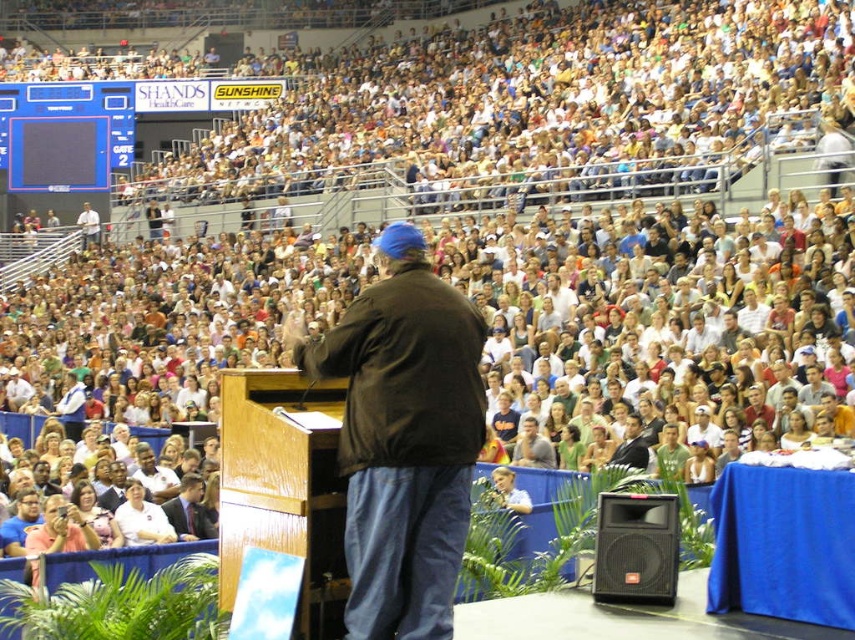
Which is below, dark brown leather jacket at center or black plastic speaker at lower right?

Positioned lower is black plastic speaker at lower right.

Who is positioned more to the left, dark brown leather jacket at center or black plastic speaker at lower right?

dark brown leather jacket at center is more to the left.

What do you see at coordinates (404, 438) in the screenshot? The width and height of the screenshot is (855, 640). I see `dark brown leather jacket at center` at bounding box center [404, 438].

I want to click on dark brown leather jacket at center, so click(x=404, y=438).

Is black plastic speaker at lower right taller than white shirt at lower left?

Correct, black plastic speaker at lower right is much taller as white shirt at lower left.

Measure the distance between black plastic speaker at lower right and camera.

They are 19.55 meters apart.

Identify the location of black plastic speaker at lower right. The image size is (855, 640). (635, 548).

Does dark brown leather jacket at center have a greater height compared to white shirt at lower left?

Yes, dark brown leather jacket at center is taller than white shirt at lower left.

Does dark brown leather jacket at center appear under white shirt at lower left?

No.

Is point (417, 262) positioned in front of point (130, 508)?

Yes, point (417, 262) is closer to viewer.

At what (x,y) coordinates should I click in order to perform the action: click on dark brown leather jacket at center. Please return your answer as a coordinate pair (x, y). This screenshot has width=855, height=640. Looking at the image, I should click on (404, 438).